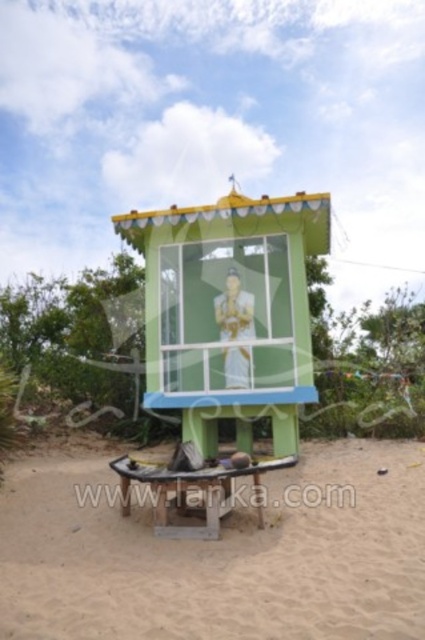
You are standing in front of the pavilion and want to place a small flag exactly between the sandy brown sand at lower center and the green painted wood at center. Where should you place the flag?

The sandy brown sand at lower center is to the left of the green painted wood at center, so you should place the flag between them, closer to the middle point between the two objects.

You are standing in front of the structure and want to locate the green painted wood at center. Where is it positioned relative to the structure?

The green painted wood at center is positioned at the center of the structure, specifically at the coordinates 0.487 on the x axis and 0.541 on the y axis.